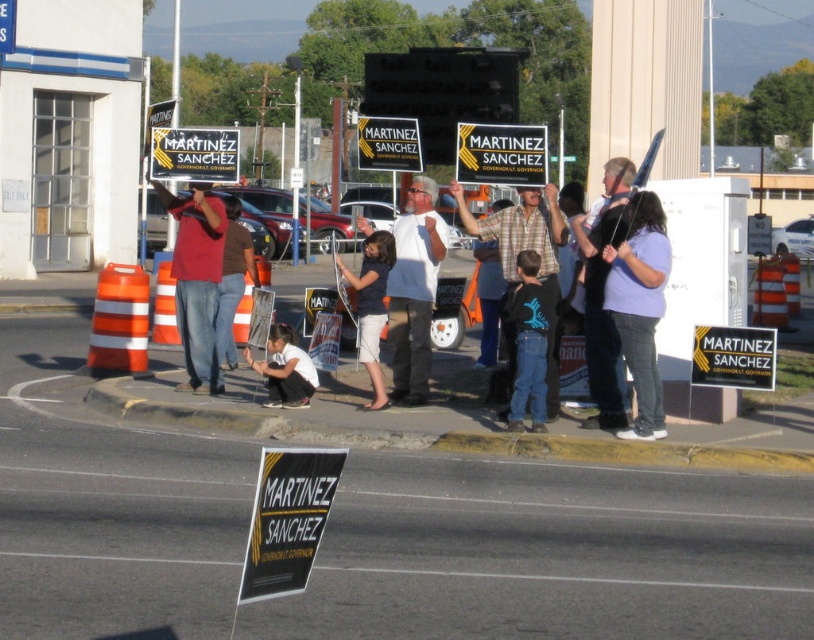
Question: Which point is closer to the camera?

Choices:
 (A) (374, 305)
 (B) (182, 136)

Answer: (A)

Question: Which point is farther to the camera?

Choices:
 (A) white fabric pants at lower center
 (B) yellow/black plastic sign at center
 (C) matte black sign at center

Answer: (B)

Question: Can you confirm if white fabric pants at lower center is positioned above yellow plastic sign at center?

Choices:
 (A) yes
 (B) no

Answer: (B)

Question: Which point is closer to the camera?

Choices:
 (A) (517, 156)
 (B) (405, 124)

Answer: (A)

Question: Does matte black sign at center have a lesser width compared to dark blue fabric shirt at center?

Choices:
 (A) yes
 (B) no

Answer: (B)

Question: Can you confirm if white fabric pants at lower center is bigger than yellow plastic sign at center?

Choices:
 (A) no
 (B) yes

Answer: (A)